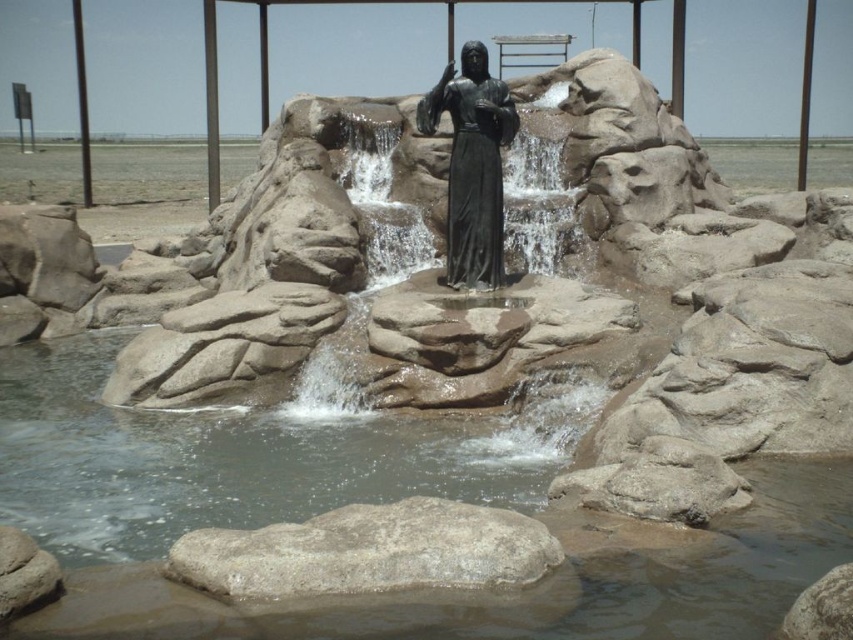
You are a landscape architect designing a garden pathway. You need to place a decorative stone that is smaller than the main statue in the scene. Which object from the image should you choose, the gray rough rock at center or the bronze statue at center?

The gray rough rock at center occupies less space than the bronze statue at center, so you should choose the gray rough rock at center as it is smaller than the main statue.

You are designing a garden and want to place a small decorative pot between the gray rough rock at center and the smooth stone waterfall at center. Based on their sizes, which object should the pot be closer to?

The gray rough rock at center is smaller than the smooth stone waterfall at center, so the pot should be placed closer to the gray rough rock at center to maintain visual balance.